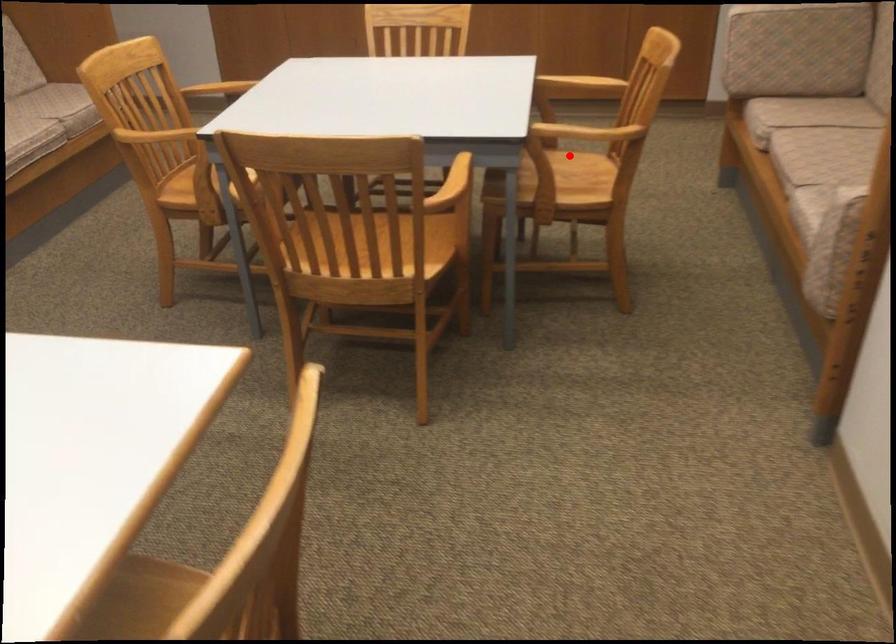
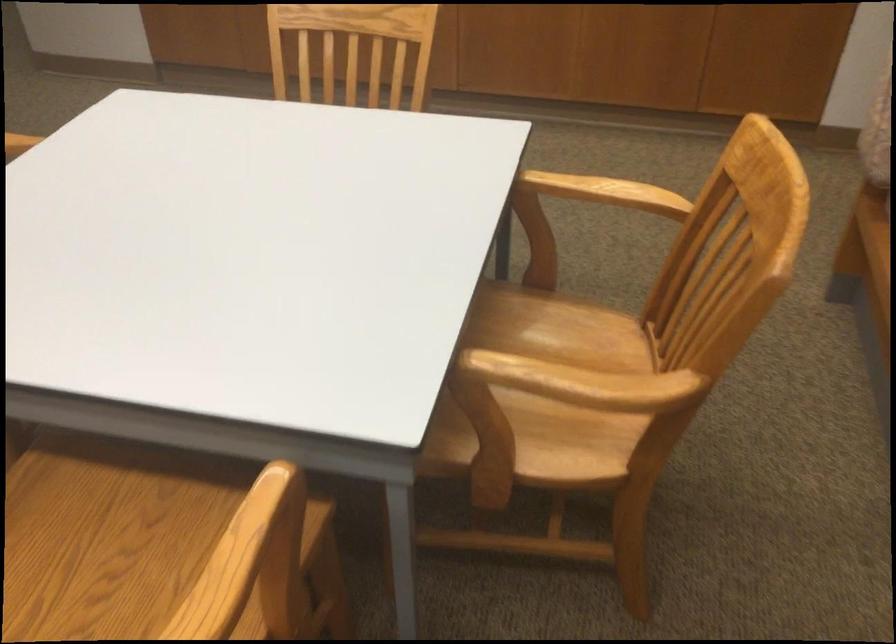
Question: I am providing you with two images of the same scene from different viewpoints. A red point is shown in image1. For the corresponding object point in image2, is it positioned nearer or farther from the camera?

Choices:
 (A) Nearer
 (B) Farther

Answer: (A)